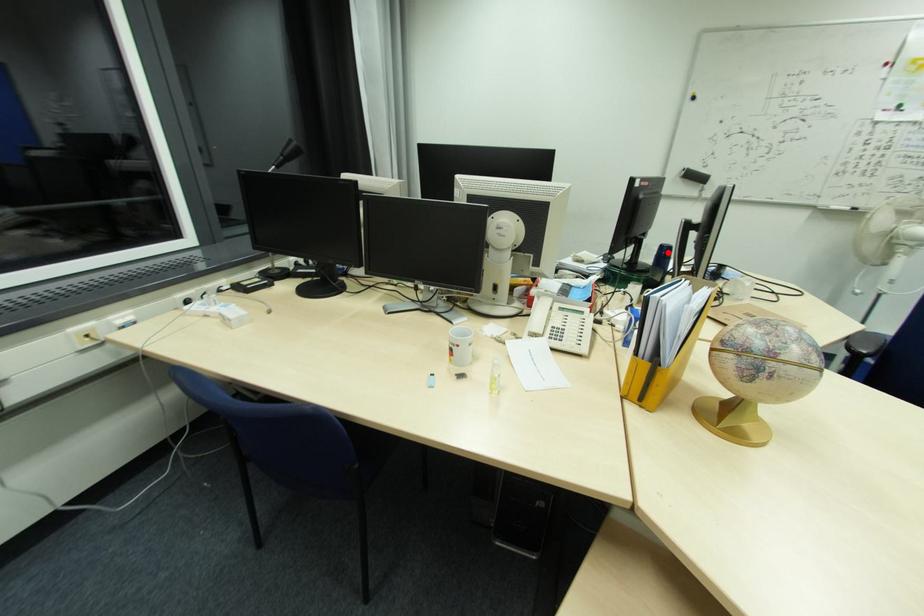
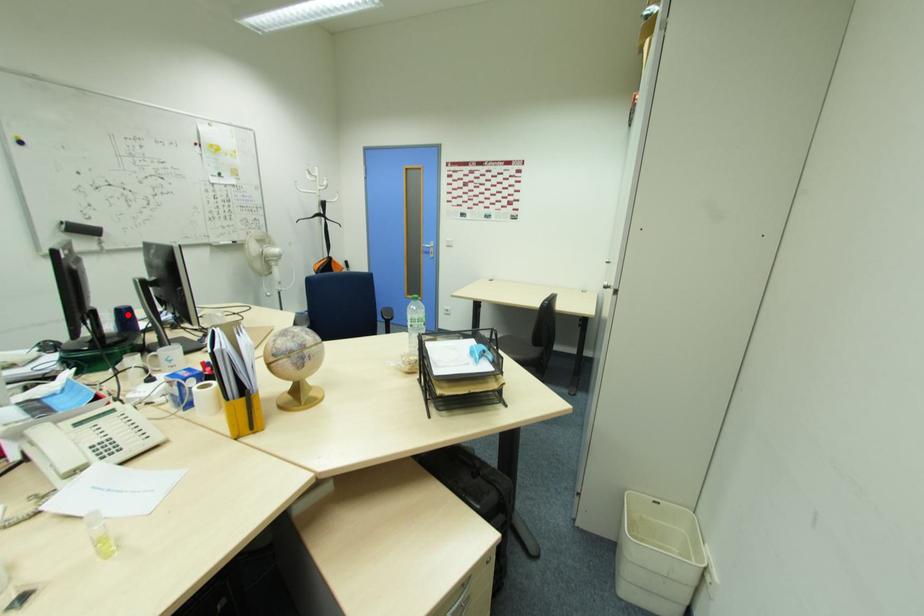
I am providing you with two images of the same scene from different viewpoints. A red point is marked on the first image and another point is marked on the second image. Is the marked point in image1 the same physical position as the marked point in image2?

Yes